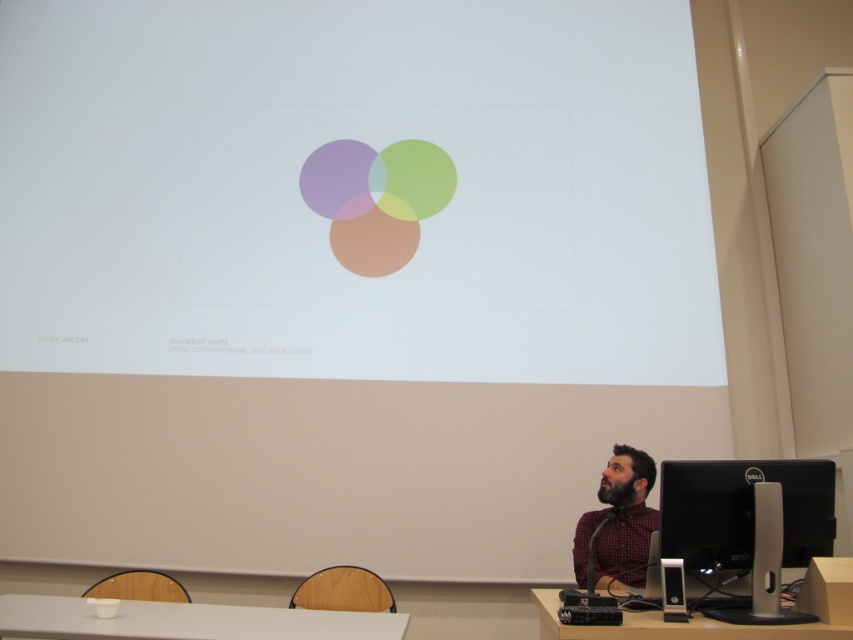
Based on the photo, can you confirm if plaid fabric shirt at lower right is taller than wooden table at lower right?

Yes, plaid fabric shirt at lower right is taller than wooden table at lower right.

Is plaid fabric shirt at lower right behind wooden table at lower right?

Yes, it is.

Does point (583, 524) lie behind point (722, 634)?

Yes, it is.

Identify the location of plaid fabric shirt at lower right. (618, 524).

Can you confirm if white glossy table at lower center is positioned below plaid fabric shirt at lower right?

Indeed, white glossy table at lower center is positioned under plaid fabric shirt at lower right.

Between white glossy table at lower center and plaid fabric shirt at lower right, which one has more height?

With more height is plaid fabric shirt at lower right.

The width and height of the screenshot is (853, 640). What do you see at coordinates (187, 620) in the screenshot? I see `white glossy table at lower center` at bounding box center [187, 620].

I want to click on white glossy table at lower center, so click(x=187, y=620).

Does black glossy monitor at lower right appear on the left side of wooden table at lower right?

No, black glossy monitor at lower right is not to the left of wooden table at lower right.

Who is positioned more to the right, black glossy monitor at lower right or wooden table at lower right?

Positioned to the right is black glossy monitor at lower right.

Between point (699, 531) and point (740, 636), which one is positioned behind?

Positioned behind is point (699, 531).

Locate an element on the screen. This screenshot has height=640, width=853. black glossy monitor at lower right is located at coordinates (741, 509).